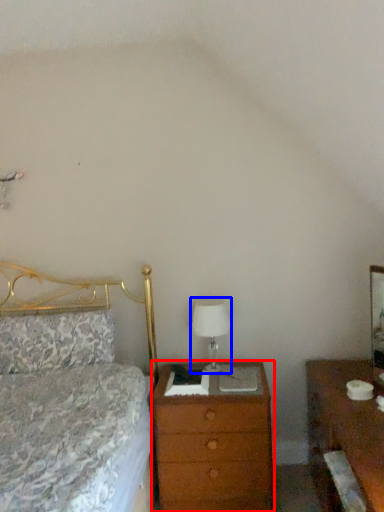
Question: Which object is further to the camera taking this photo, chest of drawers (highlighted by a red box) or table lamp (highlighted by a blue box)?

Choices:
 (A) chest of drawers
 (B) table lamp

Answer: (B)